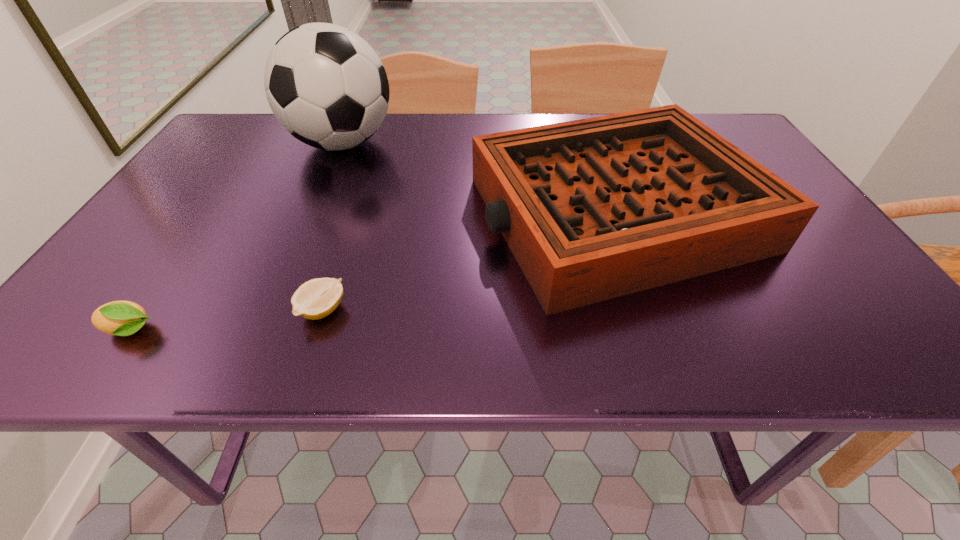
You are a GUI agent. You are given a task and a screenshot of the screen. Output one action in this format:
    pyautogui.click(x=<x>, y=<y>)
    Task: Click on the vacant area located on the left of the shorter lemon
    
    Given the screenshot: What is the action you would take?
    pyautogui.click(x=206, y=310)

The image size is (960, 540). Find the location of `soccer ball that is at the far edge`. soccer ball that is at the far edge is located at coordinates (327, 87).

You are a GUI agent. You are given a task and a screenshot of the screen. Output one action in this format:
    pyautogui.click(x=<x>, y=<y>)
    Task: Click on the gameboard located at the far edge
    
    Given the screenshot: What is the action you would take?
    pyautogui.click(x=592, y=209)

What are the coordinates of `object that is at the left edge` in the screenshot? It's located at (121, 318).

In order to click on object positioned at the right edge in this screenshot , I will do `click(592, 209)`.

Locate an element on the screen. The image size is (960, 540). object at the near left corner is located at coordinates (121, 318).

Locate an element on the screen. The height and width of the screenshot is (540, 960). object located in the far right corner section of the desktop is located at coordinates (592, 209).

In the image, there is a desktop. Where is `vacant space at the far edge`? The width and height of the screenshot is (960, 540). vacant space at the far edge is located at coordinates (425, 139).

This screenshot has width=960, height=540. I want to click on vacant space at the near edge of the desktop, so click(252, 323).

You are a GUI agent. You are given a task and a screenshot of the screen. Output one action in this format:
    pyautogui.click(x=<x>, y=<y>)
    Task: Click on the vacant space at the left edge of the desktop
    This screenshot has height=540, width=960.
    Given the screenshot: What is the action you would take?
    pyautogui.click(x=200, y=162)